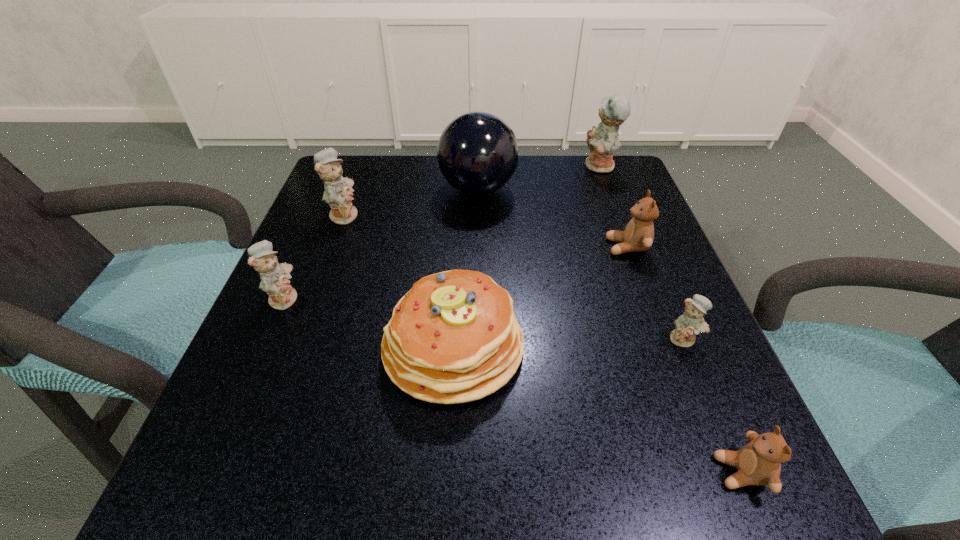
Find the location of a particular element. the second nearest teddy bear is located at coordinates (689, 324).

Find the location of `the nearest blue teddy bear`. the nearest blue teddy bear is located at coordinates (689, 324).

Find the location of a particular element. The height and width of the screenshot is (540, 960). the nearest teddy bear is located at coordinates (759, 462).

You are a GUI agent. You are given a task and a screenshot of the screen. Output one action in this format:
    pyautogui.click(x=<x>, y=<y>)
    Task: Click on the nearest object
    This screenshot has width=960, height=540.
    Given the screenshot: What is the action you would take?
    pyautogui.click(x=759, y=462)

Locate an element on the screen. free space located on the front-facing side of the tallest teddy bear is located at coordinates (560, 167).

Locate an element on the screen. free space located on the front-facing side of the tallest teddy bear is located at coordinates click(x=458, y=167).

This screenshot has height=540, width=960. I want to click on vacant space located on the front-facing side of the tallest teddy bear, so click(x=446, y=167).

The height and width of the screenshot is (540, 960). I want to click on vacant space positioned on the side of the black bowling ball with the finger holes, so click(598, 189).

Where is `free space located on the front-facing side of the third smallest blue teddy bear`? free space located on the front-facing side of the third smallest blue teddy bear is located at coordinates (518, 214).

Locate an element on the screen. vacant area located 0.330m on the front-facing side of the third farthest teddy bear is located at coordinates (440, 247).